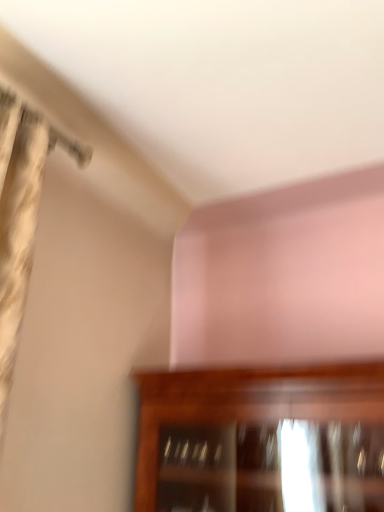
What do you see at coordinates (261, 439) in the screenshot? This screenshot has width=384, height=512. I see `brown wooden cabinet at center` at bounding box center [261, 439].

Where is `brown wooden cabinet at center`? The image size is (384, 512). brown wooden cabinet at center is located at coordinates (261, 439).

Identify the location of brown wooden cabinet at center. The height and width of the screenshot is (512, 384). (261, 439).